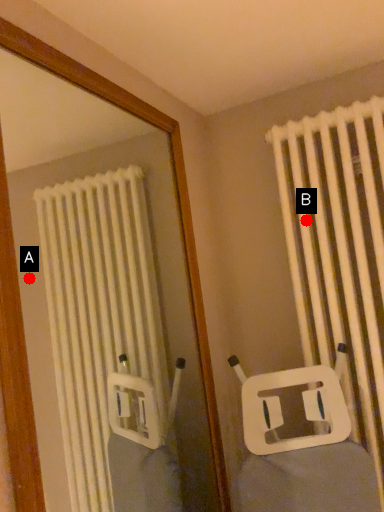
Question: Two points are circled on the image, labeled by A and B beside each circle. Which point is closer to the camera taking this photo?

Choices:
 (A) A is closer
 (B) B is closer

Answer: (B)